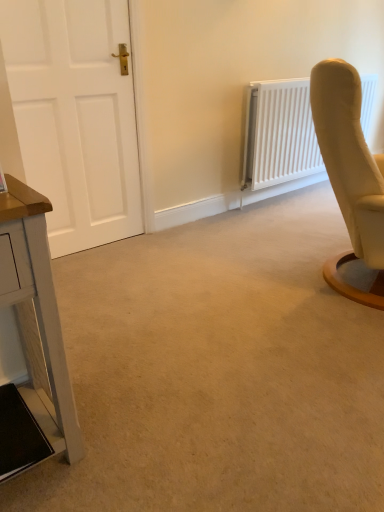
Question: Can you confirm if white matte radiator at upper right is smaller than white matte door at left?

Choices:
 (A) yes
 (B) no

Answer: (B)

Question: From a real-world perspective, is white matte radiator at upper right positioned under white matte door at left based on gravity?

Choices:
 (A) no
 (B) yes

Answer: (B)

Question: Is white matte radiator at upper right oriented towards white matte door at left?

Choices:
 (A) no
 (B) yes

Answer: (A)

Question: Considering the relative sizes of white matte radiator at upper right and white matte door at left in the image provided, is white matte radiator at upper right taller than white matte door at left?

Choices:
 (A) no
 (B) yes

Answer: (A)

Question: Can we say white matte radiator at upper right lies outside white matte door at left?

Choices:
 (A) yes
 (B) no

Answer: (A)

Question: Looking at the image, does white painted wood table at left seem bigger or smaller compared to white matte radiator at upper right?

Choices:
 (A) big
 (B) small

Answer: (B)

Question: Considering the positions of point (28, 194) and point (266, 137), is point (28, 194) closer or farther from the camera than point (266, 137)?

Choices:
 (A) closer
 (B) farther

Answer: (A)

Question: Considering the positions of white painted wood table at left and white matte radiator at upper right in the image, is white painted wood table at left wider or thinner than white matte radiator at upper right?

Choices:
 (A) thin
 (B) wide

Answer: (B)

Question: Is white painted wood table at left to the left or to the right of white matte radiator at upper right in the image?

Choices:
 (A) right
 (B) left

Answer: (B)

Question: Based on their sizes in the image, would you say white matte door at left is bigger or smaller than white painted wood table at left?

Choices:
 (A) small
 (B) big

Answer: (A)

Question: From the image's perspective, is white matte door at left positioned above or below white painted wood table at left?

Choices:
 (A) below
 (B) above

Answer: (B)

Question: Would you say white matte door at left is inside or outside white painted wood table at left?

Choices:
 (A) inside
 (B) outside

Answer: (B)

Question: From their relative heights in the image, would you say white matte door at left is taller or shorter than white painted wood table at left?

Choices:
 (A) short
 (B) tall

Answer: (B)

Question: Is white painted wood table at left taller or shorter than white matte door at left?

Choices:
 (A) short
 (B) tall

Answer: (A)

Question: Is white painted wood table at left bigger or smaller than white matte door at left?

Choices:
 (A) big
 (B) small

Answer: (A)